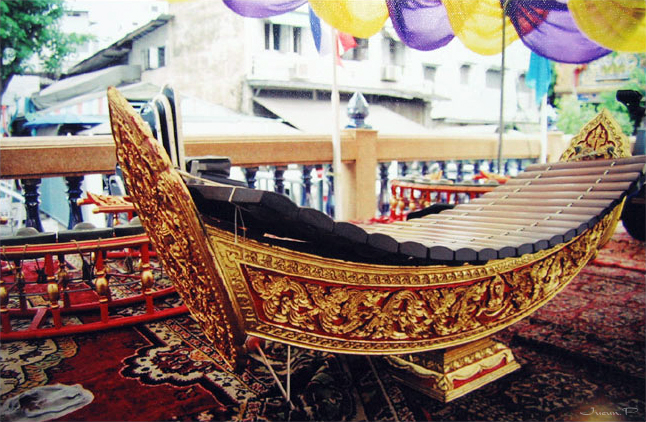
In order to click on decorated rug in this screenshot , I will do `click(176, 364)`, `click(174, 394)`, `click(559, 386)`, `click(610, 299)`.